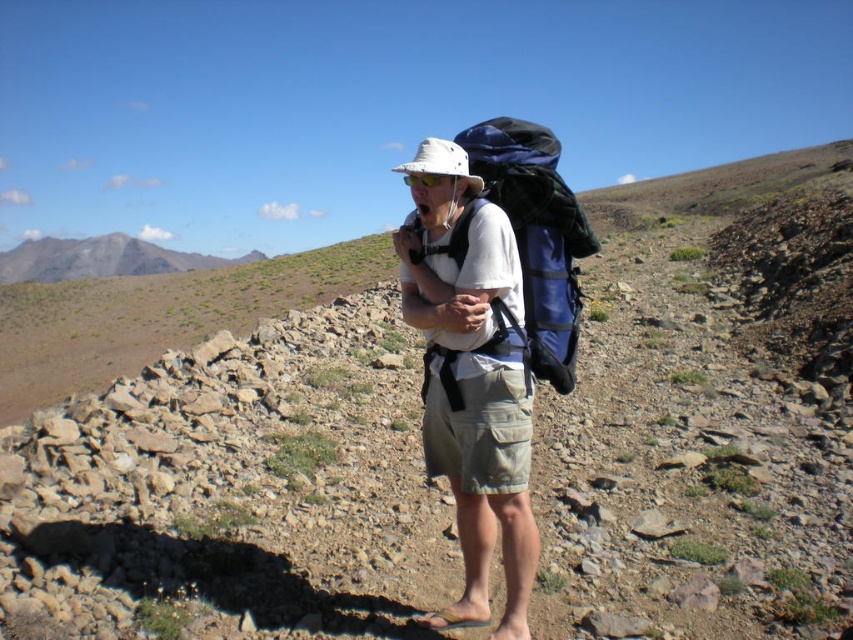
Question: Estimate the real-world distances between objects in this image. Which object is farther from the blue fabric backpack at center?

Choices:
 (A) gray rocky mountain at upper left
 (B) matte white hat at center

Answer: (A)

Question: Among these points, which one is farthest from the camera?

Choices:
 (A) [44, 276]
 (B) [428, 294]

Answer: (A)

Question: Is matte white hat at center in front of gray rocky mountain at upper left?

Choices:
 (A) no
 (B) yes

Answer: (B)

Question: From the image, what is the correct spatial relationship of matte white hat at center in relation to gray rocky mountain at upper left?

Choices:
 (A) left
 (B) right

Answer: (B)

Question: Considering the relative positions of blue fabric backpack at center and gray rocky mountain at upper left in the image provided, where is blue fabric backpack at center located with respect to gray rocky mountain at upper left?

Choices:
 (A) right
 (B) left

Answer: (A)

Question: Which point appears closest to the camera in this image?

Choices:
 (A) (509, 291)
 (B) (543, 307)
 (C) (82, 252)

Answer: (A)